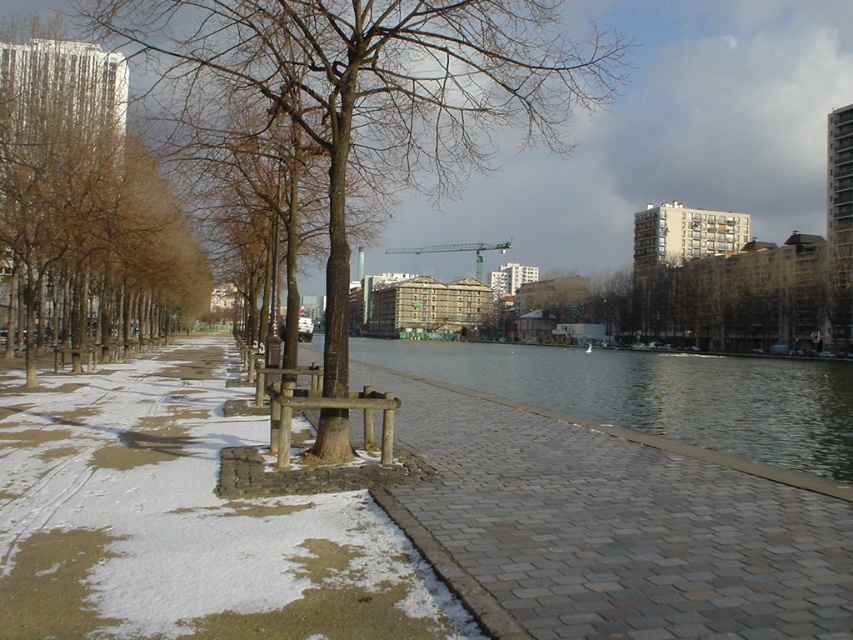
Which is more to the left, brown wood tree at center or wooden bench at center?

From the viewer's perspective, wooden bench at center appears more on the left side.

Looking at this image, which of these two, brown wood tree at center or wooden bench at center, stands taller?

With more height is brown wood tree at center.

Does point (410, 125) come farther from viewer compared to point (345, 397)?

Yes, point (410, 125) is farther from viewer.

Identify the location of brown wood tree at center. The width and height of the screenshot is (853, 640). (376, 88).

Which is below, brown smooth tree at left or wooden park bench at center?

wooden park bench at center is below.

Between brown smooth tree at left and wooden park bench at center, which one appears on the right side from the viewer's perspective?

wooden park bench at center

Between point (51, 106) and point (283, 369), which one is positioned behind?

The point (51, 106) is behind.

This screenshot has height=640, width=853. Find the location of `brown smooth tree at left`. brown smooth tree at left is located at coordinates (85, 211).

Is brown smooth tree at left above clear water at center?

Yes, brown smooth tree at left is above clear water at center.

Who is taller, brown smooth tree at left or clear water at center?

Standing taller between the two is brown smooth tree at left.

This screenshot has width=853, height=640. I want to click on brown smooth tree at left, so click(85, 211).